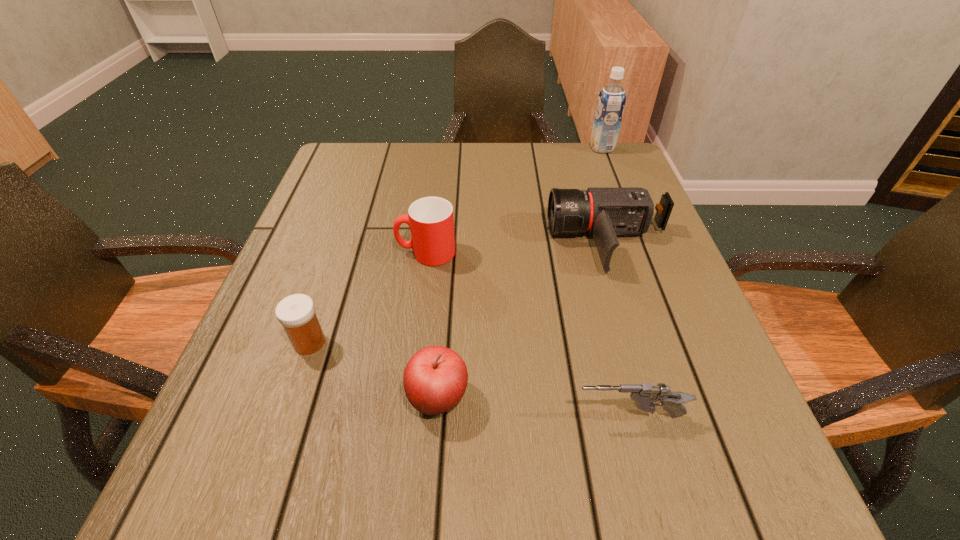
Where is `free area in between the medicine and the cup`? The image size is (960, 540). free area in between the medicine and the cup is located at coordinates (368, 298).

The image size is (960, 540). Identify the location of vacant region between the apple and the camcorder. (524, 320).

The height and width of the screenshot is (540, 960). I want to click on free spot between the soya milk and the fourth farthest object, so click(456, 245).

The width and height of the screenshot is (960, 540). Identify the location of the fourth closest object to the tallest object. (435, 379).

Identify the location of the third closest object to the apple. Image resolution: width=960 pixels, height=540 pixels. (430, 219).

In order to click on free location that satisfies the following two spatial constraints: 1. on the front side of the apple; 2. on the left side of the medicine in this screenshot , I will do (x=291, y=397).